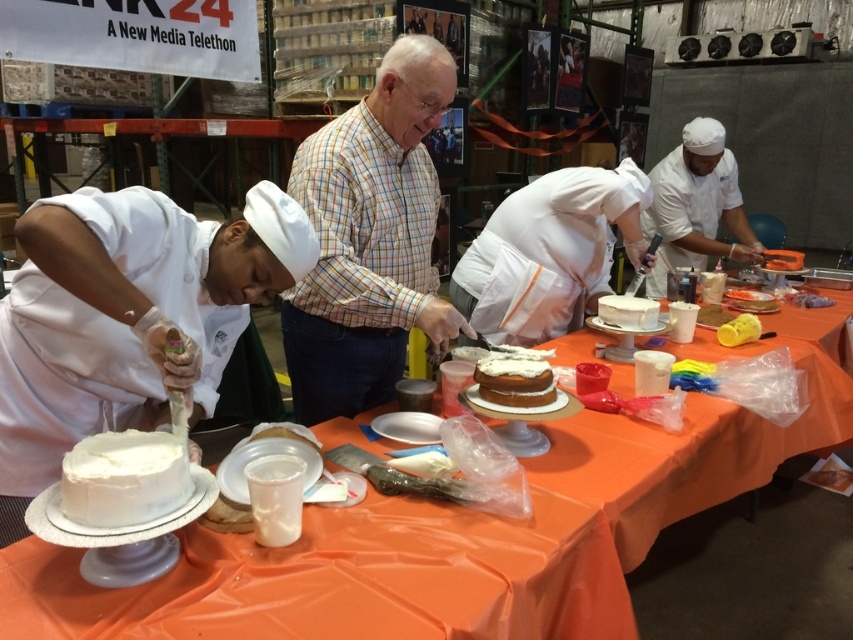
You are standing at the front of the cake decorating workshop and want to place a 36 inch cake on the orange fabric table at center. Can the cake fit on the table without overhanging the edges?

The orange fabric table at center is 37.57 inches away from the camera, so the cake will fit as the distance is greater than the cake size.